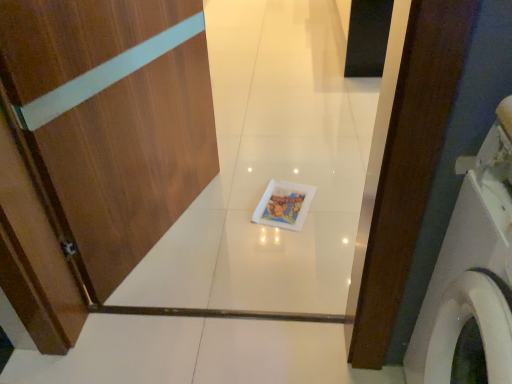
This screenshot has width=512, height=384. Find the location of `vacant area that is in front of wooden door at center`. vacant area that is in front of wooden door at center is located at coordinates (x=191, y=269).